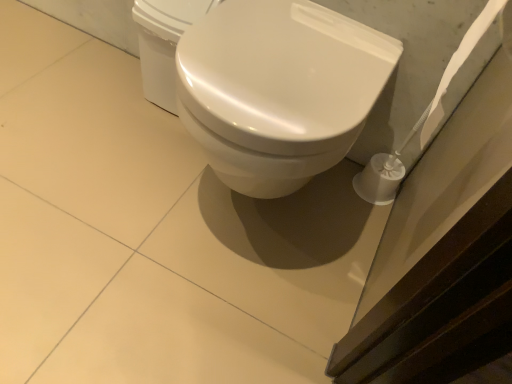
At what (x,y) coordinates should I click in order to perform the action: click on free space that is to the left of white glossy toilet at center. Please return your answer as a coordinate pair (x, y). The image size is (512, 384). Looking at the image, I should click on (96, 151).